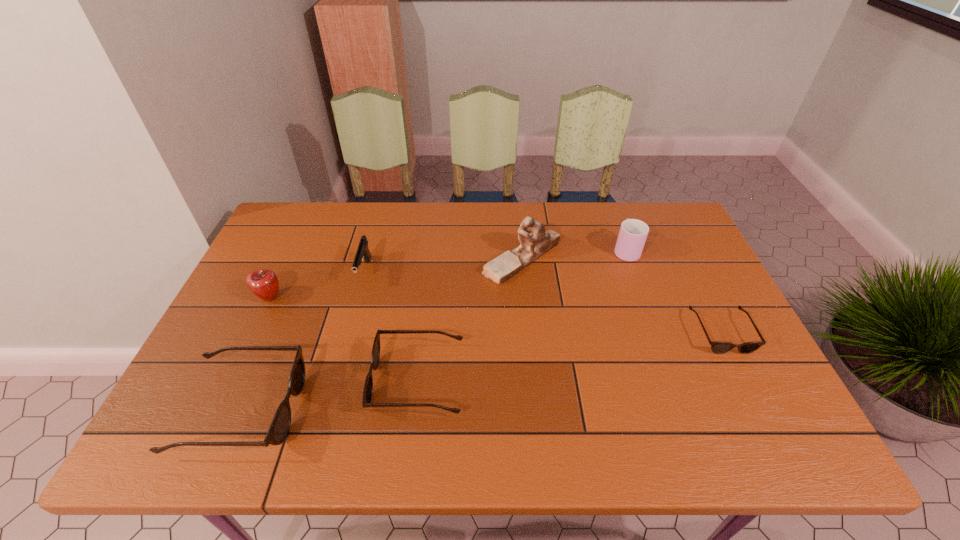
Where is `vacant space positioned with the handle on the side of the cup`? This screenshot has height=540, width=960. vacant space positioned with the handle on the side of the cup is located at coordinates (614, 217).

Where is `vacant space located 0.310m on the back of the apple`? This screenshot has height=540, width=960. vacant space located 0.310m on the back of the apple is located at coordinates (304, 222).

Find the location of `vacant space located at the muzzle of the third object from left to right`. vacant space located at the muzzle of the third object from left to right is located at coordinates (348, 332).

The height and width of the screenshot is (540, 960). I want to click on figurine that is at the far edge, so click(x=535, y=241).

This screenshot has height=540, width=960. In order to click on cup located at the far edge in this screenshot , I will do `click(633, 233)`.

The height and width of the screenshot is (540, 960). Identify the location of sunglasses that is at the left edge. (280, 425).

Where is `apple located at the left edge`? apple located at the left edge is located at coordinates (263, 283).

This screenshot has width=960, height=540. Find the location of `object that is at the right edge`. object that is at the right edge is located at coordinates (717, 347).

In order to click on object present at the near left corner in this screenshot , I will do `click(280, 425)`.

The height and width of the screenshot is (540, 960). I want to click on free space at the far edge of the desktop, so click(575, 240).